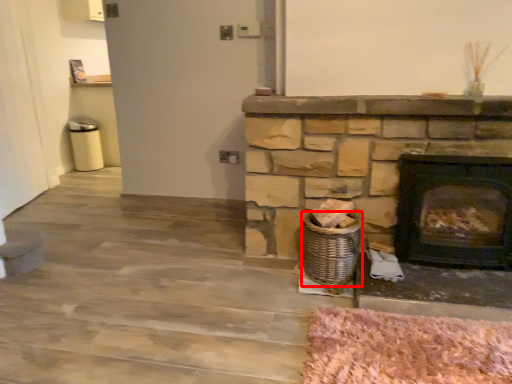
Question: Considering the relative positions of basket (annotated by the red box) and wood burning stove in the image provided, where is basket (annotated by the red box) located with respect to the staircase?

Choices:
 (A) right
 (B) left

Answer: (B)